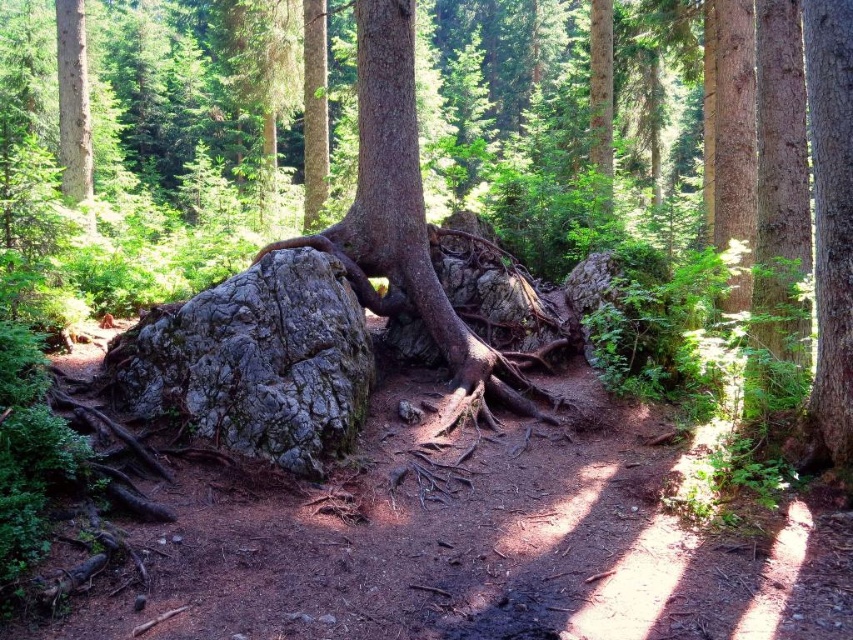
Question: Can you confirm if gray rough rock at center is smaller than gray rough boulder at center?

Choices:
 (A) no
 (B) yes

Answer: (A)

Question: Does gray rough rock at center have a smaller size compared to gray rough boulder at center?

Choices:
 (A) yes
 (B) no

Answer: (B)

Question: Which of the following is the closest to the observer?

Choices:
 (A) (236, 330)
 (B) (263, 324)

Answer: (A)

Question: Is gray rough rock at center above gray rough boulder at center?

Choices:
 (A) no
 (B) yes

Answer: (B)